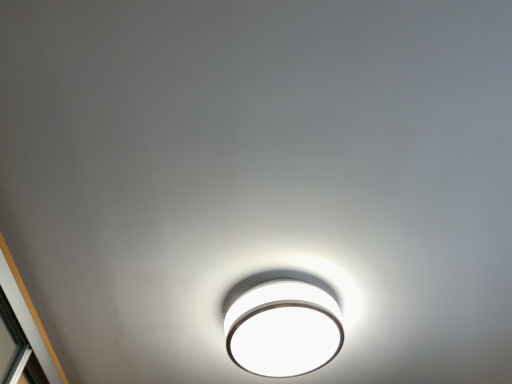
In order to face white glossy lamp at center, should I rotate leftwards or rightwards?

It's best to rotate right around 4.030 degrees.

The width and height of the screenshot is (512, 384). What do you see at coordinates (283, 327) in the screenshot?
I see `white glossy lamp at center` at bounding box center [283, 327].

Locate an element on the screen. This screenshot has width=512, height=384. white glossy lamp at center is located at coordinates (283, 327).

In order to click on white glossy lamp at center in this screenshot , I will do (283, 327).